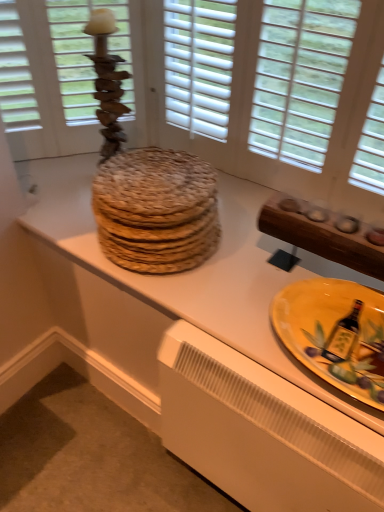
The width and height of the screenshot is (384, 512). I want to click on free space above wooden textured platters at center (from a real-world perspective), so click(x=191, y=267).